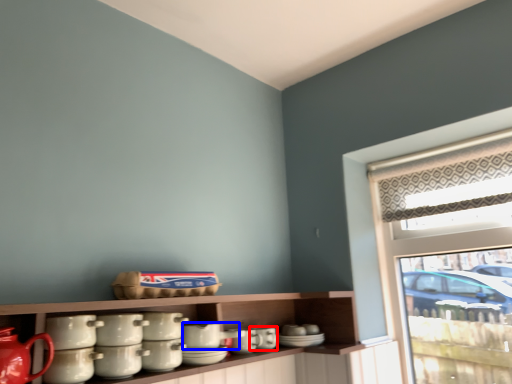
Question: Which point is closer to the camera, tableware (highlighted by a red box) or tableware (highlighted by a blue box)?

Choices:
 (A) tableware
 (B) tableware

Answer: (B)